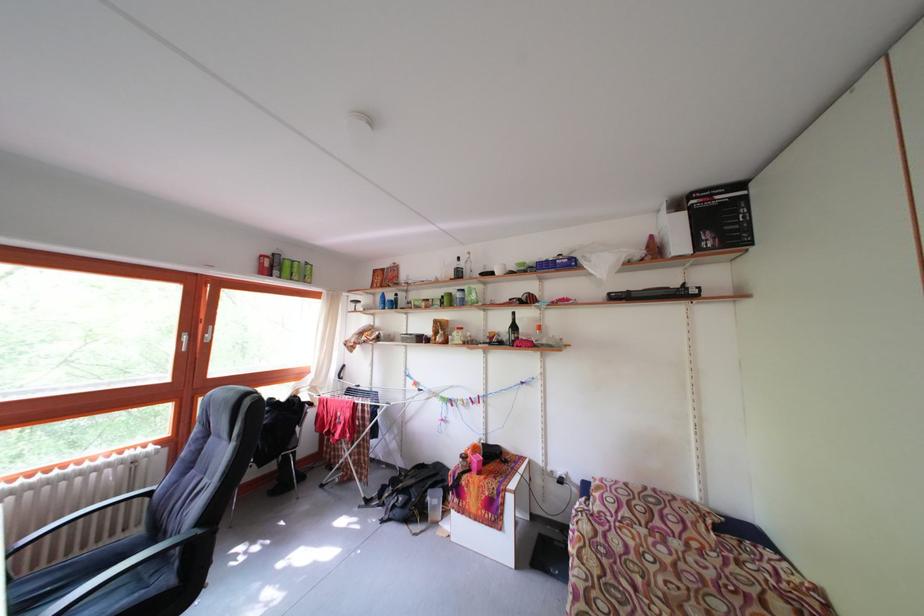
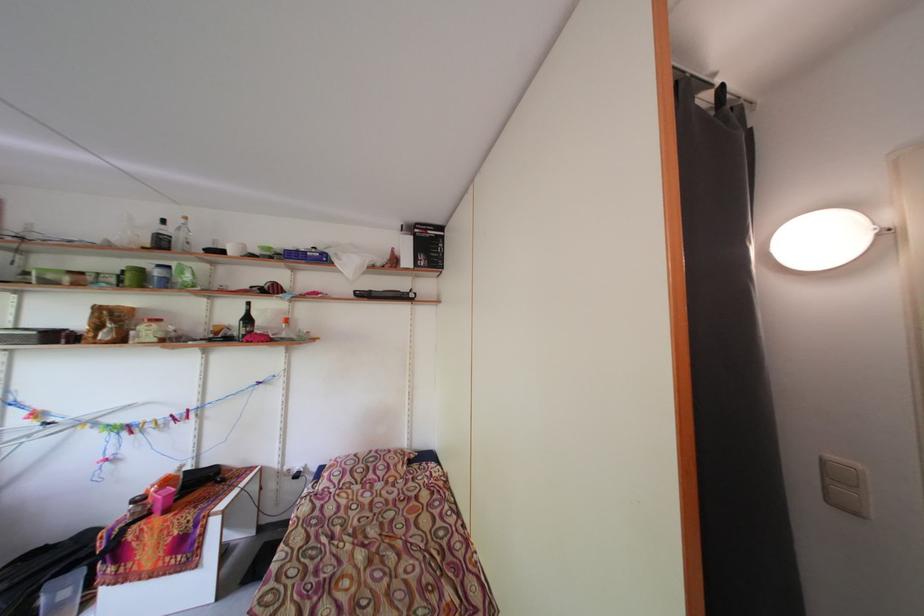
Locate, in the second image, the point that corresponds to [714,241] in the first image.

(430, 262)